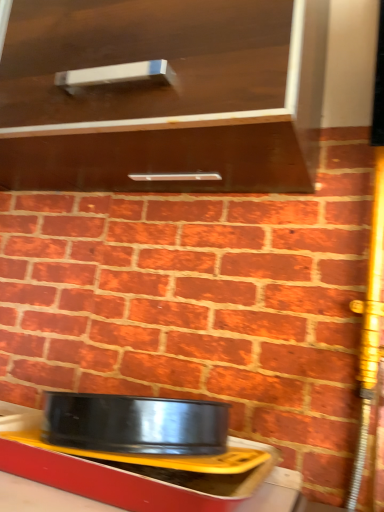
Question: Should I look upward or downward to see matte brown cabinet at upper center?

Choices:
 (A) up
 (B) down

Answer: (A)

Question: Does metallic yellow tray at lower center lie behind matte brown cabinet at upper center?

Choices:
 (A) no
 (B) yes

Answer: (B)

Question: From the image's perspective, is metallic yellow tray at lower center under matte brown cabinet at upper center?

Choices:
 (A) no
 (B) yes

Answer: (B)

Question: Considering the relative positions of metallic yellow tray at lower center and matte brown cabinet at upper center in the image provided, is metallic yellow tray at lower center in front of matte brown cabinet at upper center?

Choices:
 (A) yes
 (B) no

Answer: (B)

Question: Is metallic yellow tray at lower center located outside matte brown cabinet at upper center?

Choices:
 (A) no
 (B) yes

Answer: (B)

Question: Can you confirm if metallic yellow tray at lower center is smaller than matte brown cabinet at upper center?

Choices:
 (A) no
 (B) yes

Answer: (B)

Question: Is metallic yellow tray at lower center at the right side of matte brown cabinet at upper center?

Choices:
 (A) no
 (B) yes

Answer: (B)

Question: Could you tell me if matte brown cabinet at upper center is turned towards metallic yellow tray at lower center?

Choices:
 (A) no
 (B) yes

Answer: (A)

Question: Considering the relative sizes of matte brown cabinet at upper center and metallic yellow tray at lower center in the image provided, is matte brown cabinet at upper center shorter than metallic yellow tray at lower center?

Choices:
 (A) yes
 (B) no

Answer: (B)

Question: Is the position of matte brown cabinet at upper center more distant than that of metallic yellow tray at lower center?

Choices:
 (A) yes
 (B) no

Answer: (B)

Question: Can you confirm if matte brown cabinet at upper center is positioned to the right of metallic yellow tray at lower center?

Choices:
 (A) yes
 (B) no

Answer: (B)

Question: Is matte brown cabinet at upper center far from metallic yellow tray at lower center?

Choices:
 (A) no
 (B) yes

Answer: (A)

Question: From a real-world perspective, is matte brown cabinet at upper center positioned under metallic yellow tray at lower center based on gravity?

Choices:
 (A) no
 (B) yes

Answer: (A)

Question: Is matte brown cabinet at upper center wider or thinner than metallic yellow tray at lower center?

Choices:
 (A) thin
 (B) wide

Answer: (B)